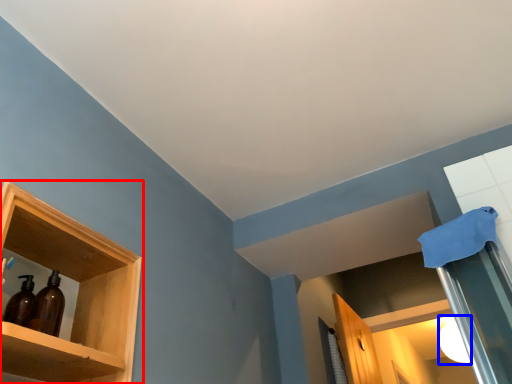
Question: Which object appears farthest to the camera in this image, shelf (highlighted by a red box) or lighting (highlighted by a blue box)?

Choices:
 (A) shelf
 (B) lighting

Answer: (B)